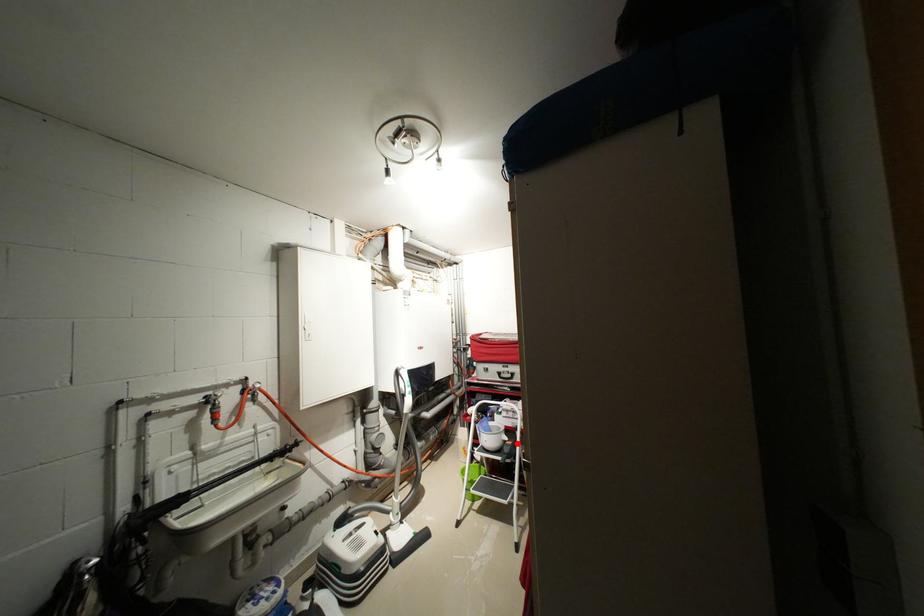
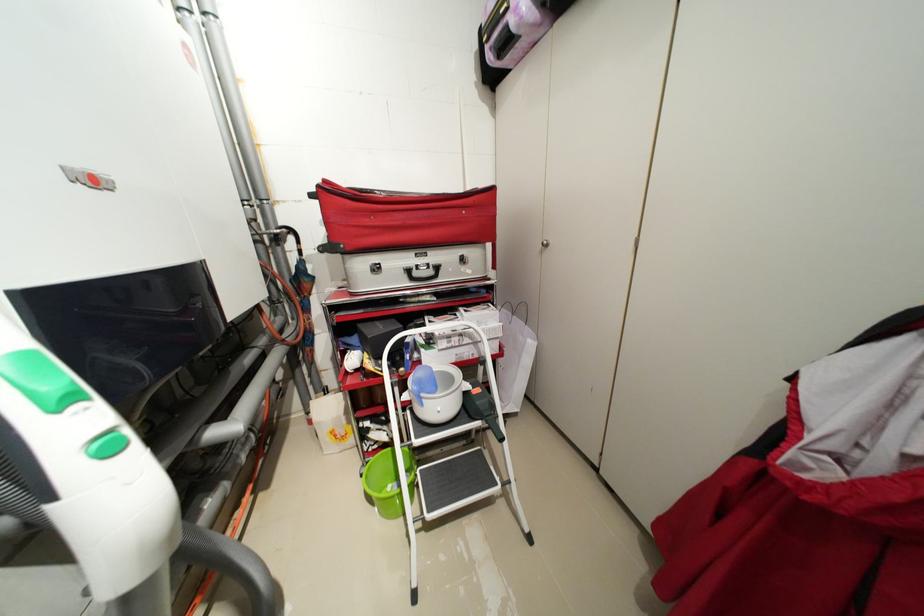
Find the pixel in the second image that matches the highlighted location in the first image.

(484, 391)